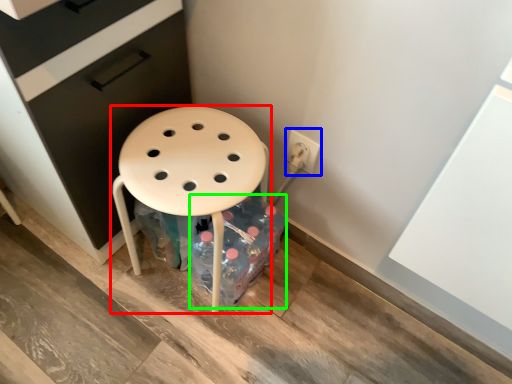
Question: Estimate the real-world distances between objects in this image. Which object is farther from stool (highlighted by a red box), electric outlet (highlighted by a blue box) or bottle (highlighted by a green box)?

Choices:
 (A) electric outlet
 (B) bottle

Answer: (A)